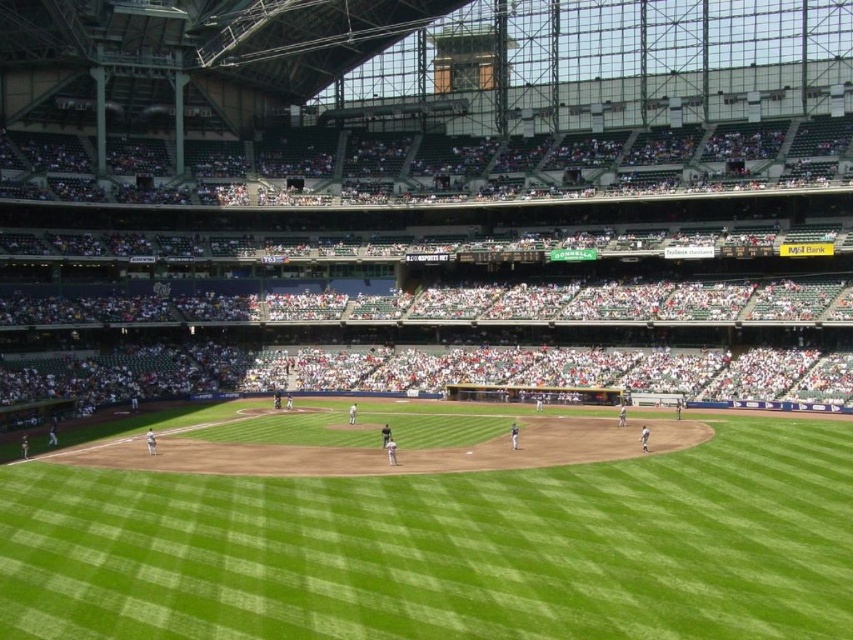
You are a spectator trying to find a seat in the stadium. You see the white plastic seats at upper center and the green grass field at center. Which area is wider?

The white plastic seats at upper center are wider than the green grass field at center.

Looking at this image, you are a drone operator trying to capture a live baseball game from above. Your drone is currently hovering at point 0.5, 0.5. You need to adjust your position to avoid the white plastic seats at upper center. Which direction should you move the drone to avoid them?

The white plastic seats at upper center are located at point (x=436, y=269). Since your drone is at (x=426, y=320), you should move it slightly to the right and down to avoid the seats.

You are a drone operator tasked with capturing aerial footage of the baseball game. Your drone must fly from the white plastic seats at upper center to the green grass field at center to get the best shot. What is the shortest distance the drone needs to travel to reach the field from the seats?

The shortest distance the drone needs to travel from the white plastic seats at upper center to the green grass field at center is 42.50 meters.